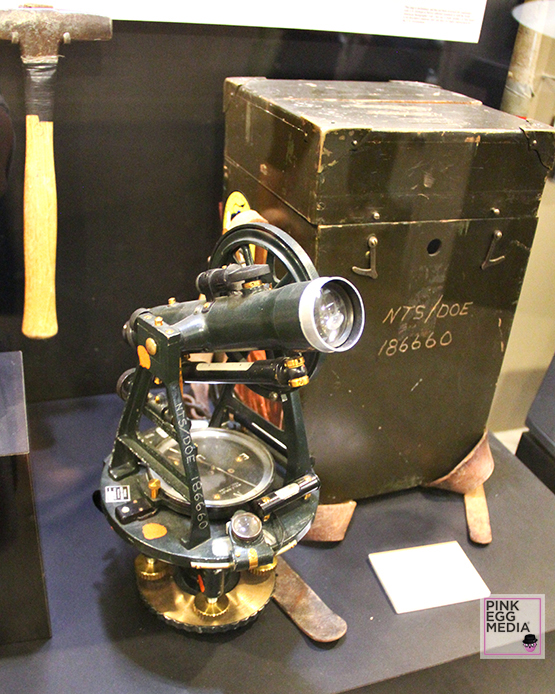
At what (x,y) coordinates should I click in order to perform the action: click on glass. Please return your answer as a coordinate pair (x, y). The width and height of the screenshot is (555, 694). Looking at the image, I should click on (329, 318).